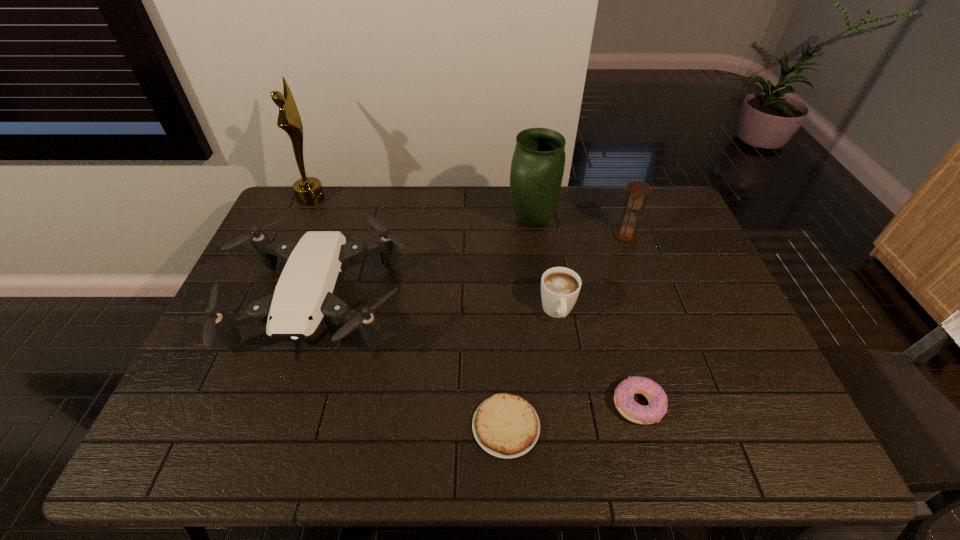
This screenshot has height=540, width=960. Find the location of `tortilla located in the near edge section of the desktop`. tortilla located in the near edge section of the desktop is located at coordinates (506, 426).

Locate an element on the screen. award present at the left edge is located at coordinates (308, 190).

Locate an element on the screen. The width and height of the screenshot is (960, 540). drone that is at the left edge is located at coordinates (305, 301).

In order to click on object that is positioned at the far left corner in this screenshot , I will do `click(308, 190)`.

You are a GUI agent. You are given a task and a screenshot of the screen. Output one action in this format:
    pyautogui.click(x=<x>, y=<y>)
    Task: Click on the vacant space at the far edge of the desktop
    The width and height of the screenshot is (960, 540).
    Given the screenshot: What is the action you would take?
    pyautogui.click(x=441, y=218)

The height and width of the screenshot is (540, 960). I want to click on free region at the near edge of the desktop, so pyautogui.click(x=289, y=450).

The height and width of the screenshot is (540, 960). I want to click on free spot at the left edge of the desktop, so click(x=184, y=421).

What are the coordinates of `blank area at the right edge` in the screenshot? It's located at (726, 318).

Identify the location of vacant space at the near left corner of the desktop. The height and width of the screenshot is (540, 960). (187, 456).

Locate an element on the screen. vacant space at the far right corner is located at coordinates (640, 225).